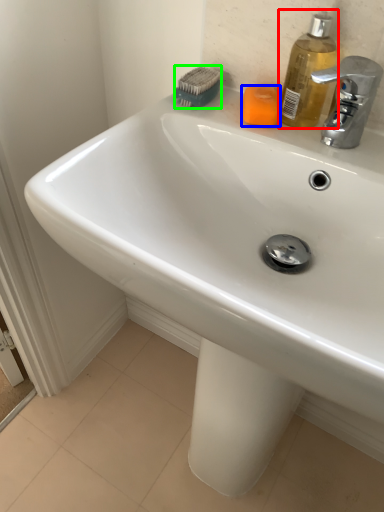
Question: Which object is positioned closest to soap dispenser (highlighted by a red box)? Select from soap (highlighted by a blue box) and brush (highlighted by a green box).

Choices:
 (A) soap
 (B) brush

Answer: (A)